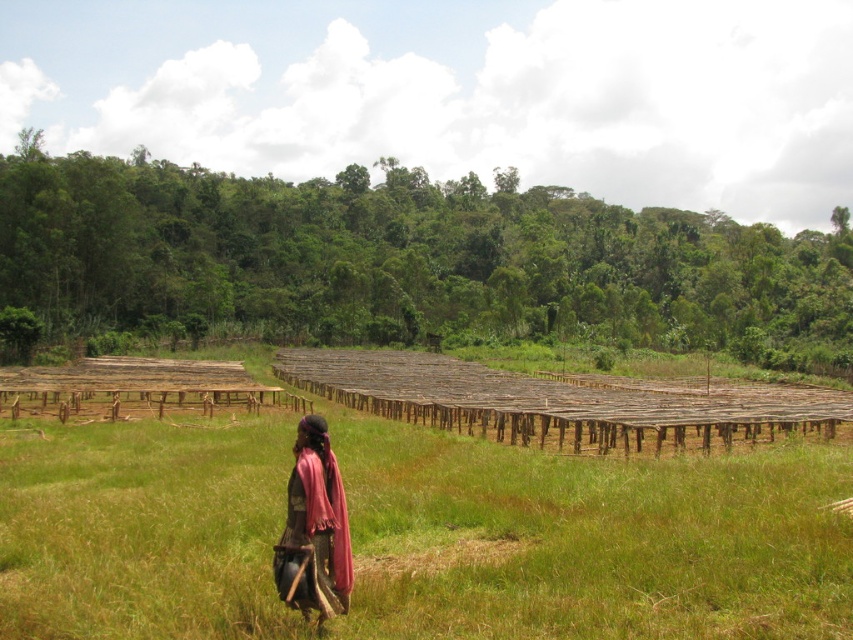
Does brown wooden racks at center have a greater height compared to dark brown fabric at center?

Incorrect, brown wooden racks at center's height is not larger of dark brown fabric at center's.

Which is behind, point (44, 625) or point (300, 433)?

The point (300, 433) is more distant.

This screenshot has width=853, height=640. What are the coordinates of `brown wooden racks at center` in the screenshot? It's located at (590, 538).